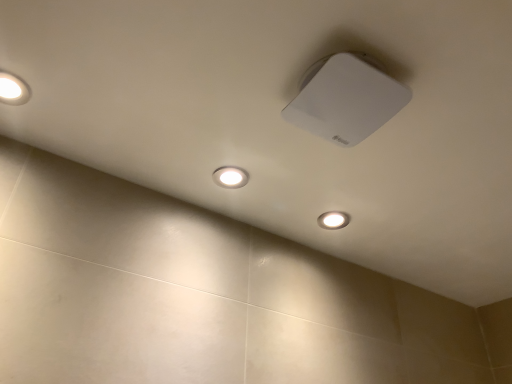
Question: Is matte white light at lower center facing away from matte white light at upper left, the first lamp in the left-to-right sequence?

Choices:
 (A) yes
 (B) no

Answer: (B)

Question: From a real-world perspective, is matte white light at lower center located higher than matte white light at upper left, the second lamp viewed from the right?

Choices:
 (A) no
 (B) yes

Answer: (A)

Question: Can you confirm if matte white light at lower center is taller than matte white light at upper left, the second lamp viewed from the right?

Choices:
 (A) no
 (B) yes

Answer: (A)

Question: Does matte white light at lower center have a smaller size compared to matte white light at upper left, the first lamp in the left-to-right sequence?

Choices:
 (A) yes
 (B) no

Answer: (A)

Question: Is matte white light at lower center wider than matte white light at upper left, the second lamp viewed from the right?

Choices:
 (A) yes
 (B) no

Answer: (B)

Question: From the image's perspective, relative to matte white light at upper left, the second lamp viewed from the right, is matte white light at lower center above or below?

Choices:
 (A) above
 (B) below

Answer: (B)

Question: Do you think matte white light at lower center is within matte white light at upper left, the first lamp in the left-to-right sequence, or outside of it?

Choices:
 (A) outside
 (B) inside

Answer: (A)

Question: Is matte white light at lower center wider or thinner than matte white light at upper left, the second lamp viewed from the right?

Choices:
 (A) wide
 (B) thin

Answer: (B)

Question: Is point (322, 213) closer or farther from the camera than point (26, 99)?

Choices:
 (A) closer
 (B) farther

Answer: (B)

Question: Is white matte square at upper center, which is counted as the first lamp, starting from the right, wider or thinner than matte white light at upper left, the first lamp in the left-to-right sequence?

Choices:
 (A) wide
 (B) thin

Answer: (A)

Question: Looking at the image, does white matte square at upper center, which is counted as the first lamp, starting from the right, seem bigger or smaller compared to matte white light at upper left, the first lamp in the left-to-right sequence?

Choices:
 (A) big
 (B) small

Answer: (A)

Question: Visually, is white matte square at upper center, which is counted as the first lamp, starting from the right, positioned to the left or to the right of matte white light at upper left, the second lamp viewed from the right?

Choices:
 (A) right
 (B) left

Answer: (A)

Question: From their relative heights in the image, would you say white matte square at upper center, positioned as the 2th lamp in left-to-right order, is taller or shorter than matte white light at upper left, the second lamp viewed from the right?

Choices:
 (A) short
 (B) tall

Answer: (B)

Question: From their relative heights in the image, would you say matte white light at lower center is taller or shorter than white matte square at upper center, which is counted as the first lamp, starting from the right?

Choices:
 (A) tall
 (B) short

Answer: (B)

Question: Would you say matte white light at lower center is inside or outside white matte square at upper center, which is counted as the first lamp, starting from the right?

Choices:
 (A) outside
 (B) inside

Answer: (A)